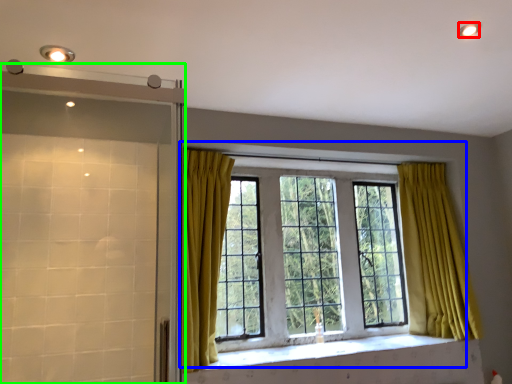
Question: Which is nearer to the lighting (highlighted by a red box)? window (highlighted by a blue box) or screen door (highlighted by a green box).

Choices:
 (A) window
 (B) screen door

Answer: (A)